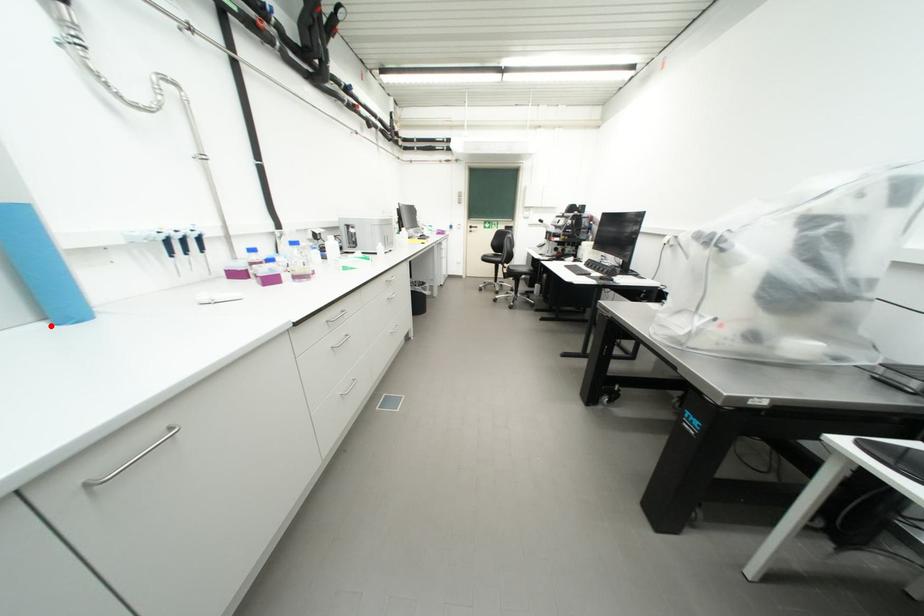
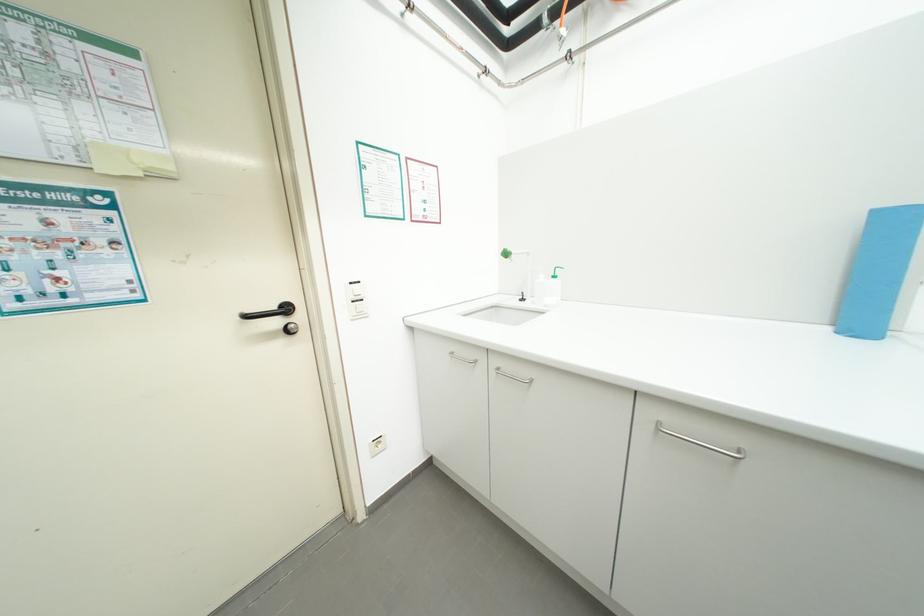
Find the pixel in the second image that matches the highlighted location in the first image.

(835, 330)